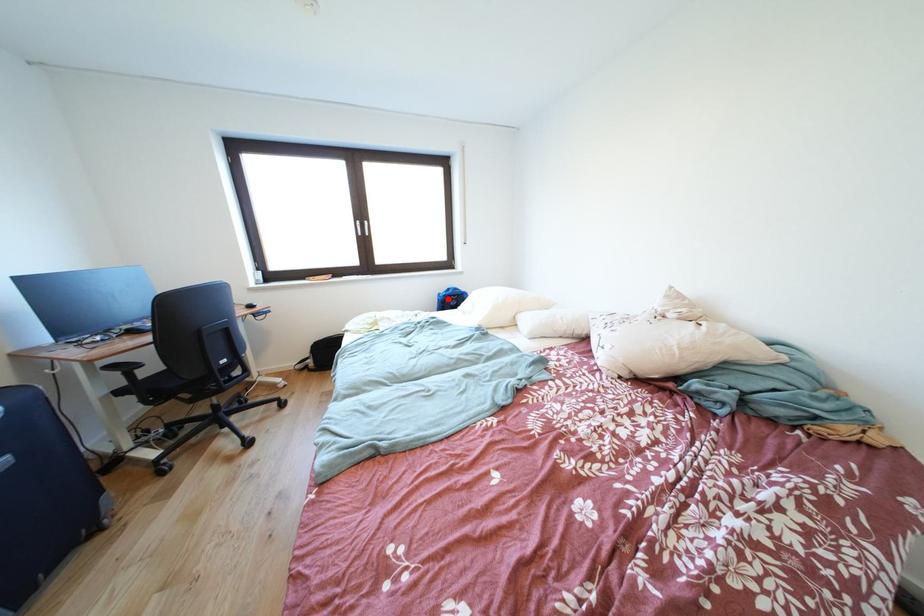
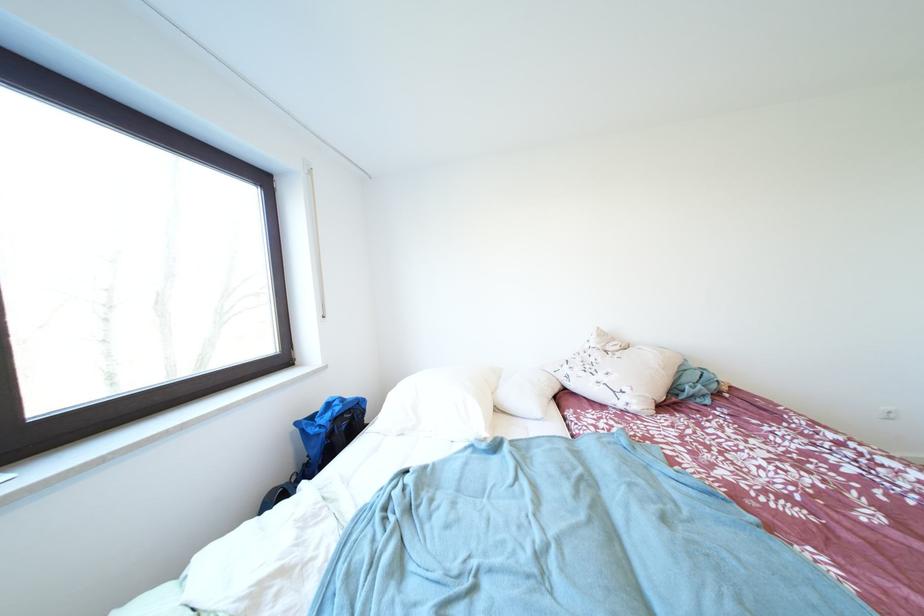
Question: I am providing you with two images of the same scene from different viewpoints. Given a red point in image1, look at the same physical point in image2. Is it:

Choices:
 (A) Closer to the viewpoint
 (B) Farther from the viewpoint

Answer: (B)